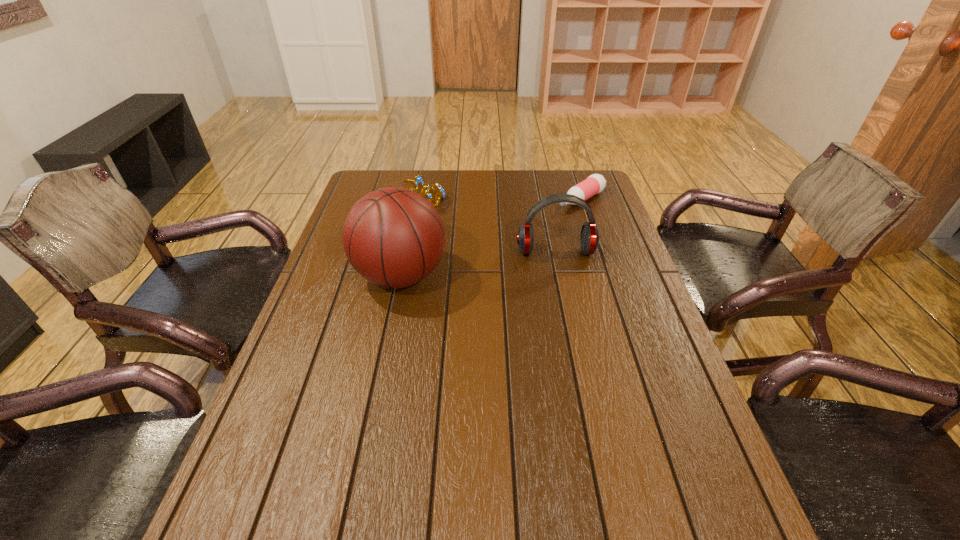
You are a GUI agent. You are given a task and a screenshot of the screen. Output one action in this format:
    pyautogui.click(x=<x>, y=<y>)
    Task: Click on the tallest object
    
    Given the screenshot: What is the action you would take?
    pyautogui.click(x=393, y=237)

At what (x,y) coordinates should I click in order to perform the action: click on the second tallest object. Please return your answer as a coordinate pair (x, y). This screenshot has height=540, width=960. Looking at the image, I should click on (589, 238).

You are a GUI agent. You are given a task and a screenshot of the screen. Output one action in this format:
    pyautogui.click(x=<x>, y=<y>)
    Task: Click on the tiara
    Image resolution: width=960 pixels, height=540 pixels.
    Given the screenshot: What is the action you would take?
    pyautogui.click(x=418, y=181)

Where is `bottle`? The width and height of the screenshot is (960, 540). bottle is located at coordinates (595, 183).

Locate an element on the screen. The width and height of the screenshot is (960, 540). vacant space located on the right of the tallest object is located at coordinates (532, 275).

Identify the location of vacant space located 0.340m on the ear cups of the earphone. (577, 352).

This screenshot has width=960, height=540. I want to click on blank space located on the front-facing side of the second shortest object, so click(476, 277).

The image size is (960, 540). What are the coordinates of `free spot located 0.370m on the front-facing side of the second shortest object` in the screenshot? It's located at (476, 277).

In order to click on vacant space situated on the front-facing side of the second shortest object in this screenshot , I will do `click(453, 248)`.

Find the location of `vacant space situated 0.280m with the cap open on the bottle`. vacant space situated 0.280m with the cap open on the bottle is located at coordinates (511, 245).